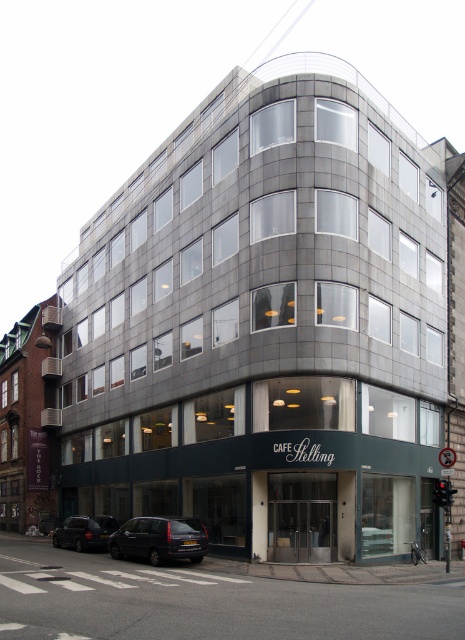
Measure the distance from dark gray metallic van at lower left to dark gray metallic car at lower left.

dark gray metallic van at lower left and dark gray metallic car at lower left are 11.05 meters apart from each other.

Based on the photo, who is more distant from viewer, (113, 548) or (93, 532)?

The point (93, 532) is behind.

What are the coordinates of `dark gray metallic van at lower left` in the screenshot? It's located at (159, 538).